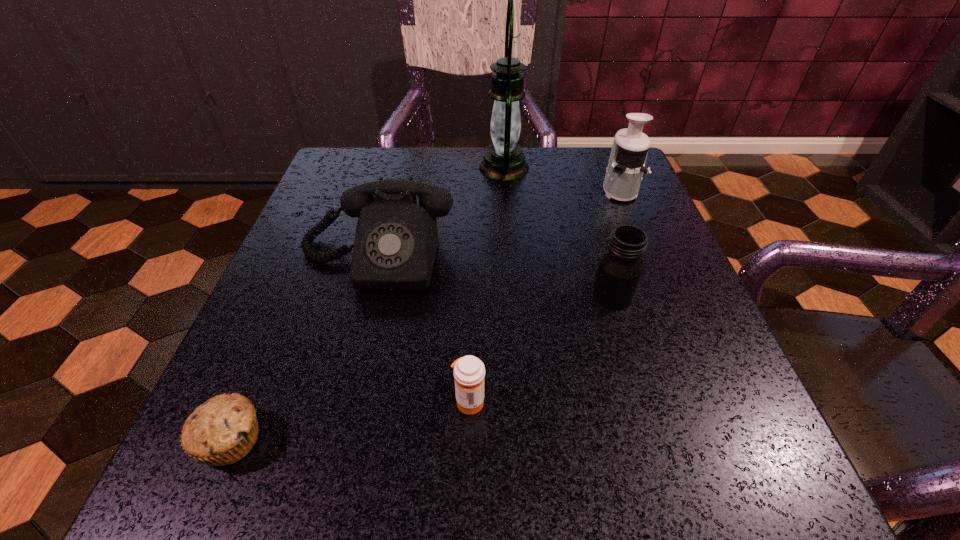
Where is `juicer present at the right edge`? juicer present at the right edge is located at coordinates (626, 165).

Locate an element on the screen. This screenshot has width=960, height=540. jar at the right edge is located at coordinates (620, 269).

Where is `object that is at the near left corner`? The width and height of the screenshot is (960, 540). object that is at the near left corner is located at coordinates (221, 431).

Locate an element on the screen. This screenshot has width=960, height=540. object that is at the far right corner is located at coordinates (626, 165).

This screenshot has height=540, width=960. Find the location of `vacant space at the far edge`. vacant space at the far edge is located at coordinates (445, 152).

You are a GUI agent. You are given a task and a screenshot of the screen. Output one action in this format:
    pyautogui.click(x=<x>, y=<y>)
    Task: Click on the vacant space at the left edge of the desktop
    Image resolution: width=960 pixels, height=540 pixels.
    Given the screenshot: What is the action you would take?
    pyautogui.click(x=246, y=354)

Identify the location of free region at the right edge of the desktop. This screenshot has width=960, height=540. (692, 415).

In the image, there is a desktop. At what (x,y) coordinates should I click in order to perform the action: click on vacant space at the far left corner. Please return your answer as a coordinate pair (x, y). The image size is (960, 540). Looking at the image, I should click on (366, 164).

Locate an element on the screen. The image size is (960, 540). vacant space at the far right corner of the desktop is located at coordinates (570, 174).

In the image, there is a desktop. At what (x,y) coordinates should I click in order to perform the action: click on free region at the near right corner. Please return your answer as a coordinate pair (x, y). This screenshot has height=540, width=960. Looking at the image, I should click on (713, 471).